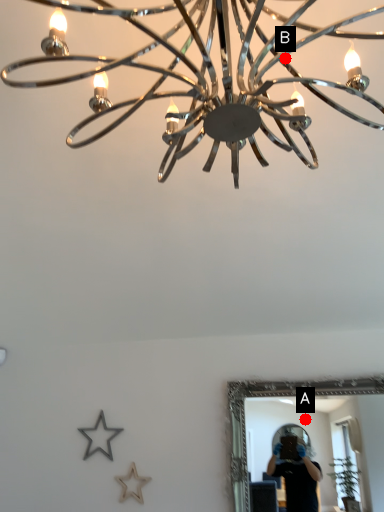
Question: Two points are circled on the image, labeled by A and B beside each circle. Which point appears farthest from the camera in this image?

Choices:
 (A) A is further
 (B) B is further

Answer: (A)